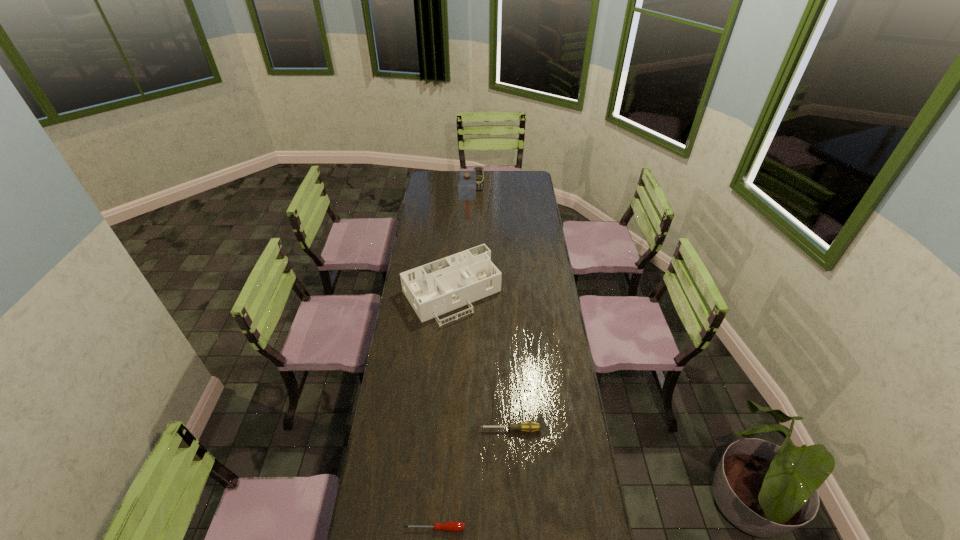
This screenshot has width=960, height=540. Identify the location of object present at the right edge. (529, 426).

Where is `vacant region at the far edge of the desktop`? This screenshot has width=960, height=540. vacant region at the far edge of the desktop is located at coordinates (502, 179).

Locate an element on the screen. vacant space at the left edge is located at coordinates (398, 311).

At what (x,y) coordinates should I click in order to perform the action: click on vacant point at the right edge. Please return your answer as a coordinate pair (x, y). Looking at the image, I should click on (544, 228).

Where is `free space at the far left corner`? This screenshot has width=960, height=540. free space at the far left corner is located at coordinates (442, 178).

Where is `free region at the far right corner of the desktop`? The width and height of the screenshot is (960, 540). free region at the far right corner of the desktop is located at coordinates (530, 188).

In order to click on empty space between the left screwdriver and the right screwdriver in this screenshot , I will do `click(472, 479)`.

The height and width of the screenshot is (540, 960). Find the location of `free space that is in between the third shortest object and the left screwdriver`. free space that is in between the third shortest object and the left screwdriver is located at coordinates (444, 410).

At what (x,y) coordinates should I click in order to perform the action: click on free space between the dollhouse and the right screwdriver. Please return your answer as a coordinate pair (x, y). Looking at the image, I should click on (481, 361).

Where is `free space between the mallet and the farther screwdriver`? free space between the mallet and the farther screwdriver is located at coordinates (489, 325).